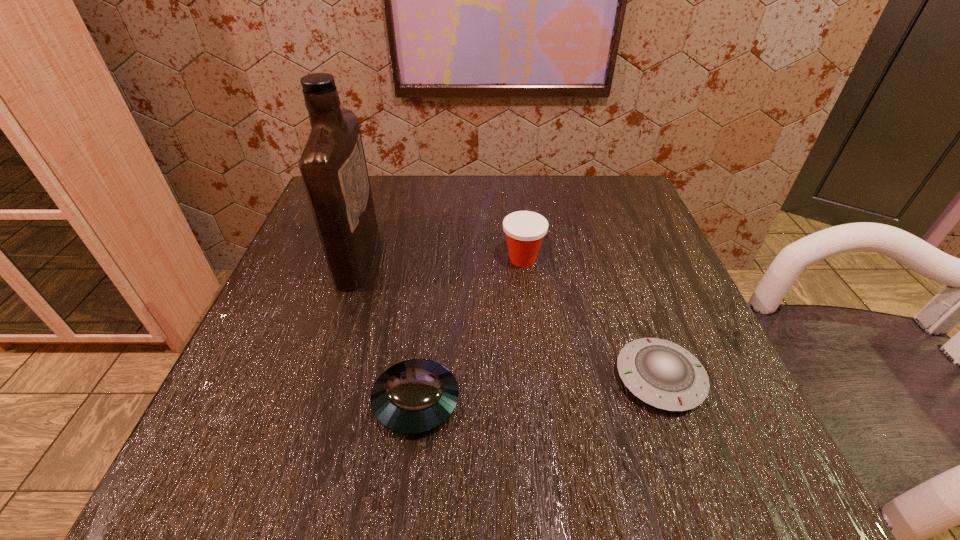
Identify the location of unoccupied area between the rightmost object and the third shortest object. (591, 319).

The width and height of the screenshot is (960, 540). In order to click on free space between the Dixie cup and the shortest object in this screenshot , I will do `click(591, 319)`.

Find the location of `vacant area that lies between the right saucer and the leftmost object`. vacant area that lies between the right saucer and the leftmost object is located at coordinates (509, 317).

Where is `vacant area between the left saucer and the shorter saucer`? The height and width of the screenshot is (540, 960). vacant area between the left saucer and the shorter saucer is located at coordinates (538, 389).

Locate which object is the second closest to the left saucer. Please provide its 2D coordinates. Your answer should be formatted as a tuple, i.e. [(x, y)], where the tuple contains the x and y coordinates of a point satisfying the conditions above.

[(525, 230)]

Point out which object is positioned as the third nearest to the third shortest object. Please provide its 2D coordinates. Your answer should be formatted as a tuple, i.e. [(x, y)], where the tuple contains the x and y coordinates of a point satisfying the conditions above.

[(333, 167)]

Find the location of `vacant space that satisfies the following two spatial constraints: 1. on the label side of the taller saucer; 2. on the right side of the tallest object`. vacant space that satisfies the following two spatial constraints: 1. on the label side of the taller saucer; 2. on the right side of the tallest object is located at coordinates (x=311, y=401).

Image resolution: width=960 pixels, height=540 pixels. What are the coordinates of `vacant space that satisfies the following two spatial constraints: 1. on the label side of the Dixie cup; 2. on the left side of the tallest object` in the screenshot? It's located at (357, 259).

In order to click on vacant position in the image that satisfies the following two spatial constraints: 1. on the label side of the leftmost object; 2. on the right side of the second tallest object in this screenshot , I will do pos(357,259).

Image resolution: width=960 pixels, height=540 pixels. Find the location of `free spot that satisfies the following two spatial constraints: 1. on the back side of the rightmost object; 2. on the label side of the liquor`. free spot that satisfies the following two spatial constraints: 1. on the back side of the rightmost object; 2. on the label side of the liquor is located at coordinates (615, 255).